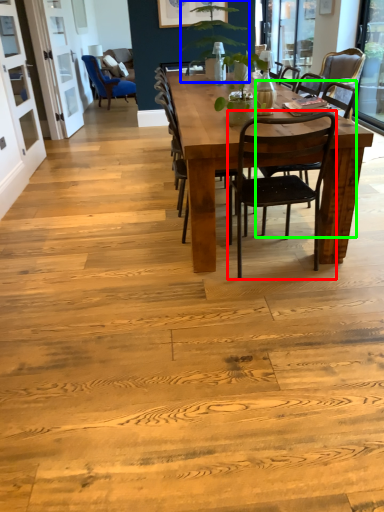
Question: Estimate the real-world distances between objects in this image. Which object is closer to chair (highlighted by a red box), houseplant (highlighted by a blue box) or chair (highlighted by a green box)?

Choices:
 (A) houseplant
 (B) chair

Answer: (B)